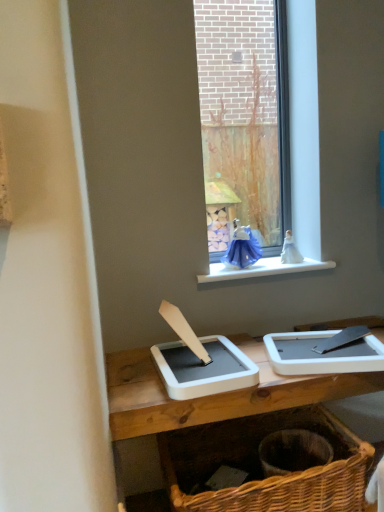
Question: Is blue glass window at center outside of white plastic window sill at upper center?

Choices:
 (A) no
 (B) yes

Answer: (B)

Question: From the image's perspective, is blue glass window at center over white plastic window sill at upper center?

Choices:
 (A) no
 (B) yes

Answer: (B)

Question: Does blue glass window at center have a lesser height compared to white plastic window sill at upper center?

Choices:
 (A) no
 (B) yes

Answer: (A)

Question: Can you confirm if blue glass window at center is bigger than white plastic window sill at upper center?

Choices:
 (A) yes
 (B) no

Answer: (A)

Question: Considering the relative sizes of blue glass window at center and white plastic window sill at upper center in the image provided, is blue glass window at center wider than white plastic window sill at upper center?

Choices:
 (A) yes
 (B) no

Answer: (B)

Question: From a real-world perspective, does blue glass window at center sit lower than white plastic window sill at upper center?

Choices:
 (A) no
 (B) yes

Answer: (A)

Question: Is white plastic window sill at upper center bigger than woven brown basket at lower right?

Choices:
 (A) yes
 (B) no

Answer: (B)

Question: Is the depth of white plastic window sill at upper center less than that of woven brown basket at lower right?

Choices:
 (A) yes
 (B) no

Answer: (B)

Question: Is white plastic window sill at upper center to the right of woven brown basket at lower right from the viewer's perspective?

Choices:
 (A) yes
 (B) no

Answer: (A)

Question: Would you say white plastic window sill at upper center contains woven brown basket at lower right?

Choices:
 (A) yes
 (B) no

Answer: (B)

Question: From the image's perspective, is white plastic window sill at upper center under woven brown basket at lower right?

Choices:
 (A) yes
 (B) no

Answer: (B)

Question: Is white plastic window sill at upper center in contact with woven brown basket at lower right?

Choices:
 (A) yes
 (B) no

Answer: (B)

Question: Is woven brown basket at lower right turned away from blue glass window at center?

Choices:
 (A) no
 (B) yes

Answer: (A)